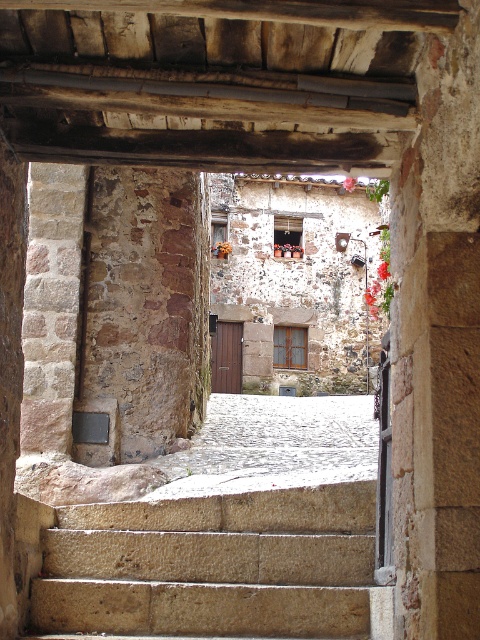
Who is taller, natural stone stairs at center or rustic stone pillar at left?

rustic stone pillar at left is taller.

Consider the image. Can you confirm if natural stone stairs at center is smaller than rustic stone pillar at left?

Yes.

The width and height of the screenshot is (480, 640). What are the coordinates of `natural stone stairs at center` in the screenshot? It's located at (215, 566).

Locate an element on the screen. The image size is (480, 640). natural stone stairs at center is located at coordinates (215, 566).